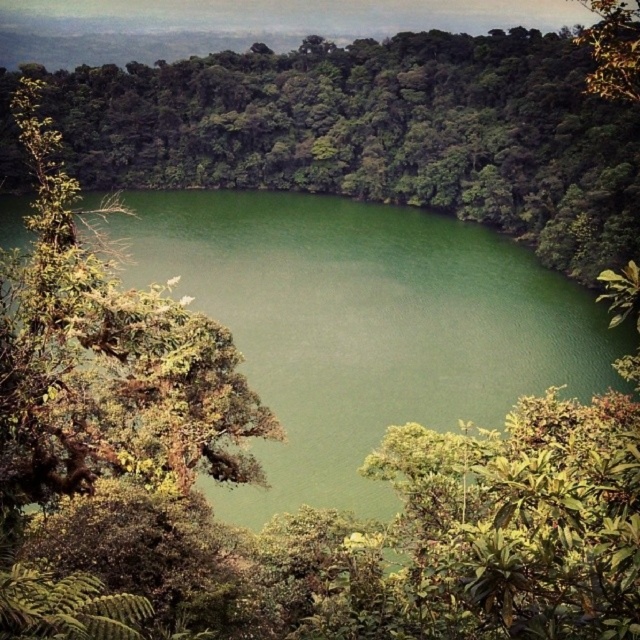
Is point (449, 129) positioned before point (129, 468)?

No, it is not.

This screenshot has height=640, width=640. Describe the element at coordinates (378, 132) in the screenshot. I see `green leafy tree at center` at that location.

The width and height of the screenshot is (640, 640). Find the location of `green leafy tree at center`. green leafy tree at center is located at coordinates (378, 132).